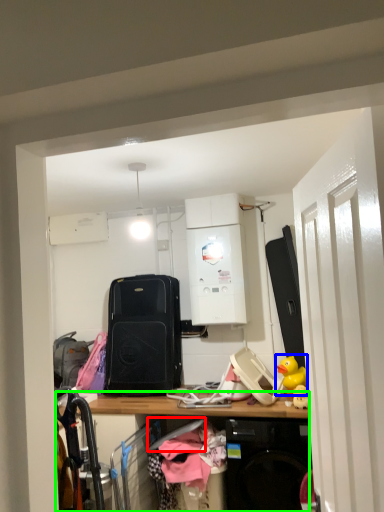
Question: Which object is positioned farthest from hanger (highlighted by a red box)? Select from toy (highlighted by a blue box) and desk (highlighted by a green box).

Choices:
 (A) toy
 (B) desk

Answer: (A)